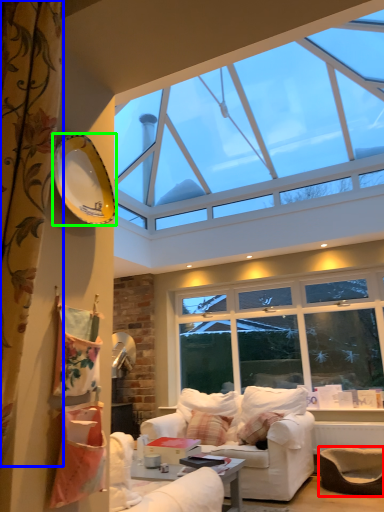
Question: Based on their relative distances, which object is nearer to armchair (highlighted by a red box)? Choose from curtain (highlighted by a blue box) and plate (highlighted by a green box).

Choices:
 (A) curtain
 (B) plate

Answer: (B)